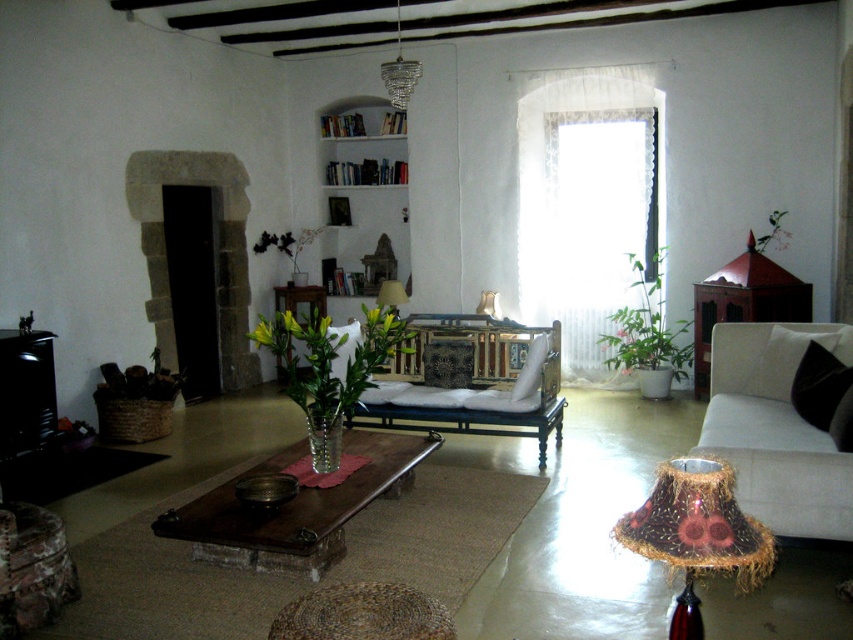
You are an interior designer assessing the living room layout. You need to determine which object, the white wooden bookshelf at upper center or the crystal glass chandelier at upper center, is taller. Based on the scene description, which one is taller?

The white wooden bookshelf at upper center is taller than the crystal glass chandelier at upper center according to the description.